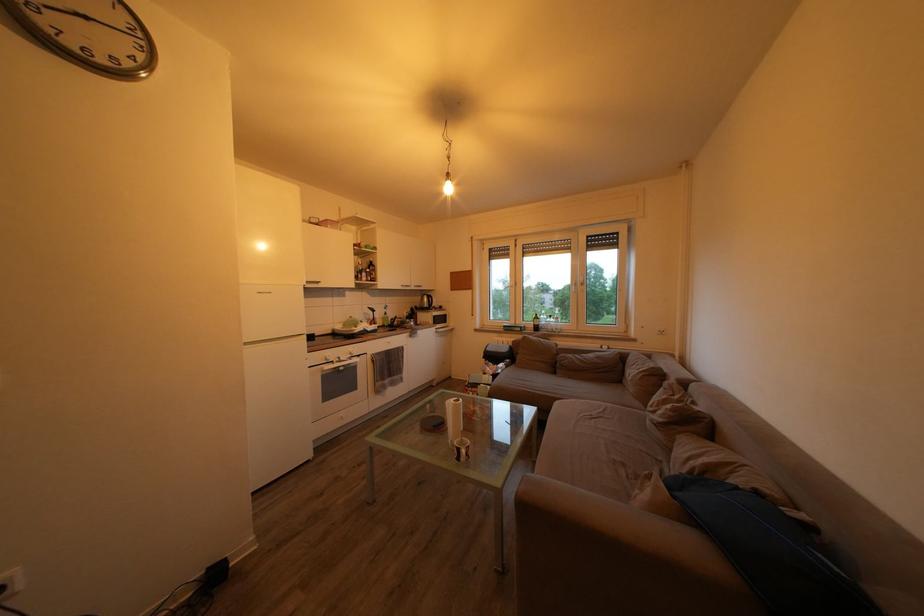
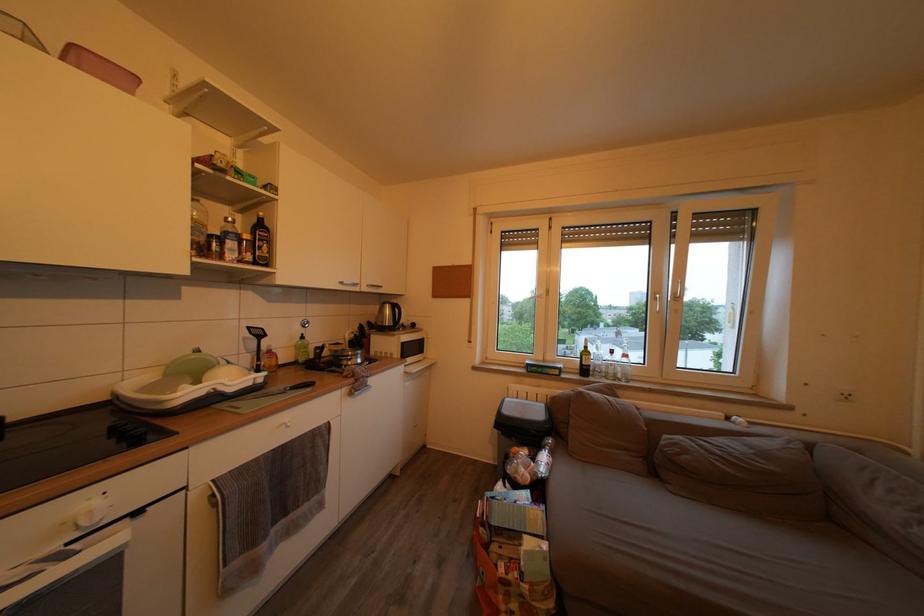
Find the pixel in the second image that matches [375,277] in the first image.

(253, 243)